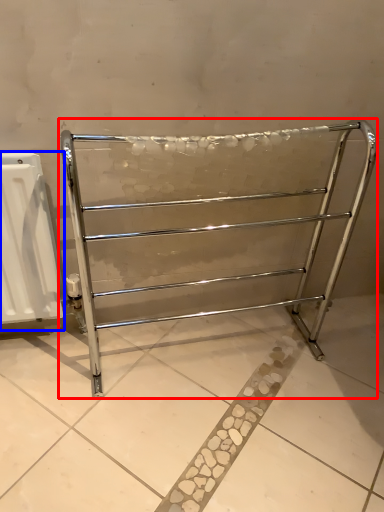
Question: Which object appears farthest to the camera in this image, furniture (highlighted by a red box) or radiator (highlighted by a blue box)?

Choices:
 (A) furniture
 (B) radiator

Answer: (B)